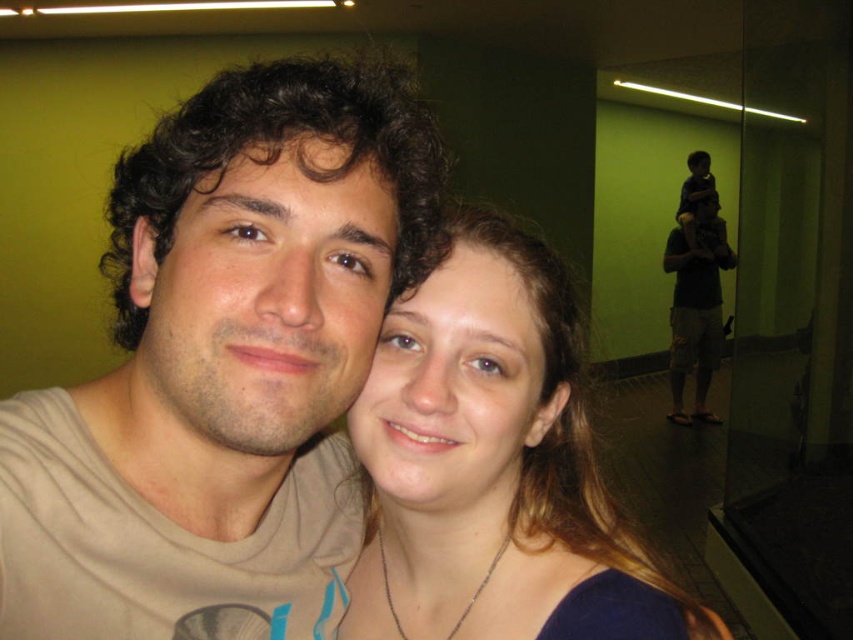
Question: Which object is closer to the camera taking this photo?

Choices:
 (A) matte gold necklace at center
 (B) matte beige shirt at center

Answer: (B)

Question: Which of the following is the closest to the observer?

Choices:
 (A) matte beige shirt at center
 (B) matte gold necklace at center

Answer: (A)

Question: Observing the image, what is the correct spatial positioning of matte beige shirt at center in reference to matte gold necklace at center?

Choices:
 (A) right
 (B) left

Answer: (B)

Question: Is matte beige shirt at center to the left of matte gold necklace at center from the viewer's perspective?

Choices:
 (A) yes
 (B) no

Answer: (A)

Question: Is matte beige shirt at center closer to the viewer compared to matte gold necklace at center?

Choices:
 (A) no
 (B) yes

Answer: (B)